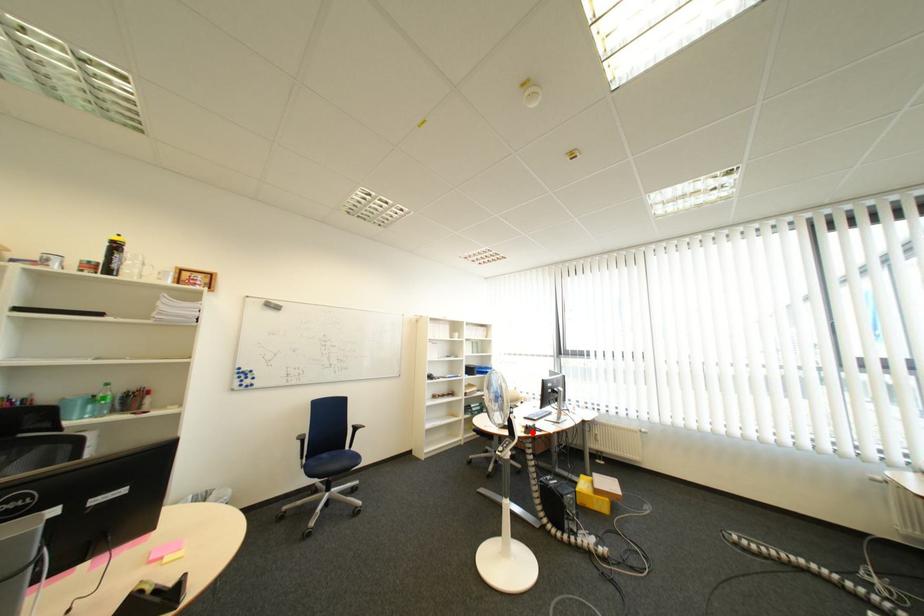
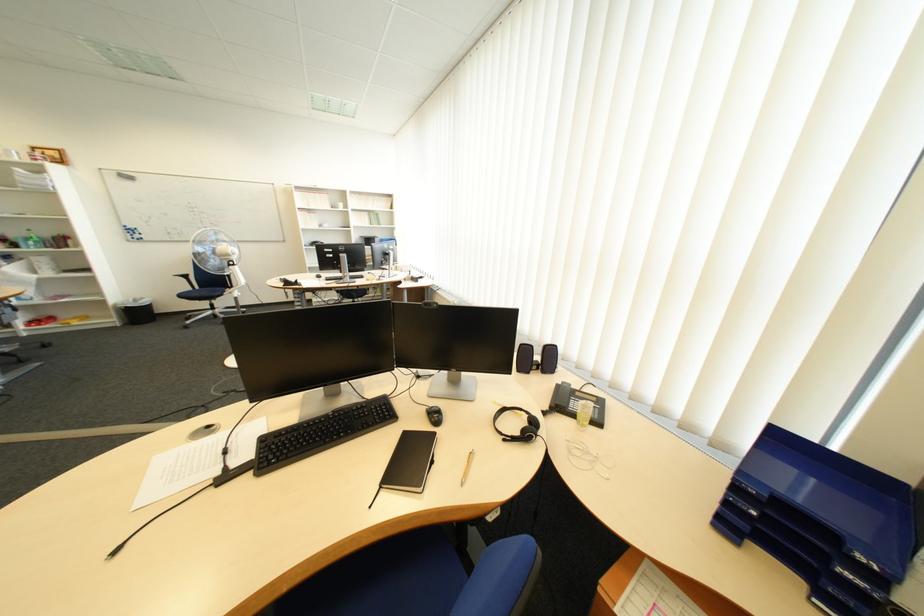
Question: I am providing you with two images of the same scene from different viewpoints. A red point is marked on the first image. Can you still see the location of the red point in image 2?

Choices:
 (A) Yes
 (B) No

Answer: (B)